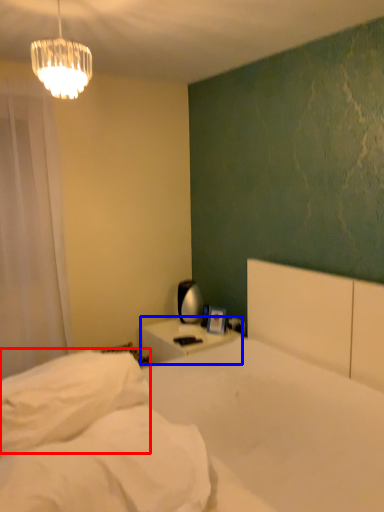
Question: Among these objects, which one is nearest to the camera, pillow (highlighted by a red box) or nightstand (highlighted by a blue box)?

Choices:
 (A) pillow
 (B) nightstand

Answer: (A)